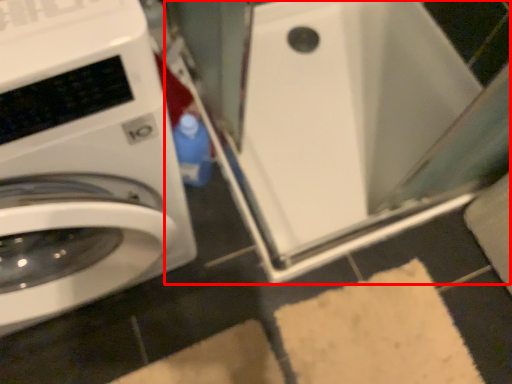
Question: From the image's perspective, where is water heater (annotated by the red box) located in relation to washing machine in the image?

Choices:
 (A) above
 (B) below

Answer: (A)